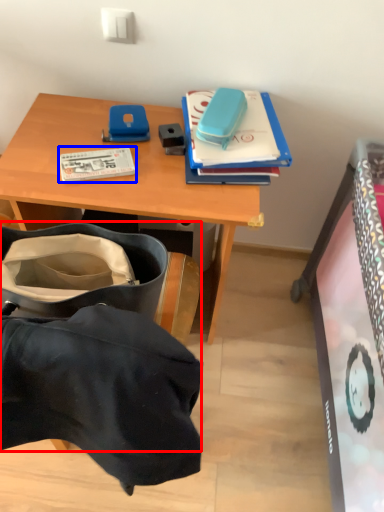
Question: Which object is closer to the camera taking this photo, luggage and bags (highlighted by a red box) or book (highlighted by a blue box)?

Choices:
 (A) luggage and bags
 (B) book

Answer: (A)